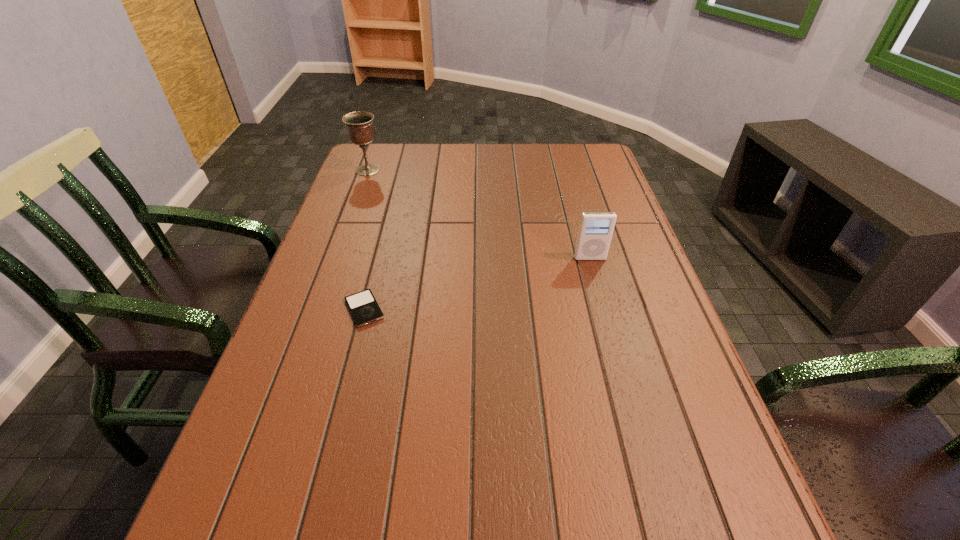
I want to click on free point between the farther iPod and the leftmost object, so click(479, 214).

Where is `vacant area between the right iPod and the shortest object`? This screenshot has height=540, width=960. vacant area between the right iPod and the shortest object is located at coordinates (477, 284).

This screenshot has width=960, height=540. I want to click on vacant region between the shorter iPod and the farthest object, so click(x=366, y=240).

This screenshot has width=960, height=540. Identify the location of free space that is in between the rightmost object and the tallest object. (479, 214).

Where is `vacant point located between the chalice and the second farthest object`? The height and width of the screenshot is (540, 960). vacant point located between the chalice and the second farthest object is located at coordinates (479, 214).

Find the location of a particular element. vacant region between the farther iPod and the farthest object is located at coordinates (479, 214).

Where is `free spot between the left iPod and the tallest object`? This screenshot has width=960, height=540. free spot between the left iPod and the tallest object is located at coordinates (366, 240).

Locate an element on the screen. empty space between the nearest object and the leftmost object is located at coordinates (366, 240).

Locate an element on the screen. object that is the second nearest to the nearer iPod is located at coordinates (359, 125).

The width and height of the screenshot is (960, 540). I want to click on object that is the closest to the farthest object, so click(363, 306).